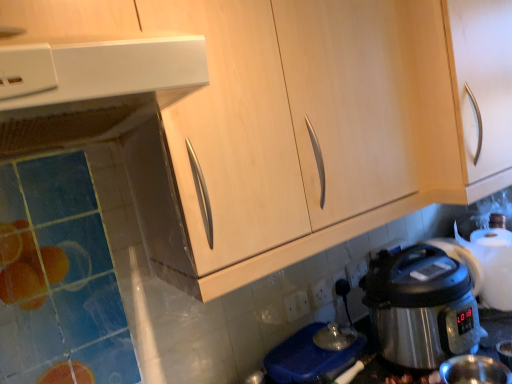
Question: In terms of width, does light wood cabinet at upper right look wider or thinner when compared to white plastic power plugs and sockets at lower center?

Choices:
 (A) wide
 (B) thin

Answer: (A)

Question: From the image's perspective, is light wood cabinet at upper right positioned above or below white plastic power plugs and sockets at lower center?

Choices:
 (A) above
 (B) below

Answer: (A)

Question: Which of these objects is positioned closest to the light wood cabinet at upper right?

Choices:
 (A) stainless steel rice cooker at lower right
 (B) white plastic power outlet at lower center
 (C) shiny metallic coffee cup at lower right
 (D) white plastic power plugs and sockets at lower center
 (E) white plastic electric outlet at lower center, arranged as the 2th electric outlet when viewed from the right

Answer: (A)

Question: Which is farther from the stainless steel rice cooker at lower right?

Choices:
 (A) white plastic electric outlet at lower center, arranged as the 2th electric outlet when viewed from the right
 (B) white plastic power outlet at lower center
 (C) white plastic power plugs and sockets at lower center
 (D) shiny metallic coffee cup at lower right
 (E) black plastic electric outlet at lower center, the first electric outlet when ordered from right to left

Answer: (B)